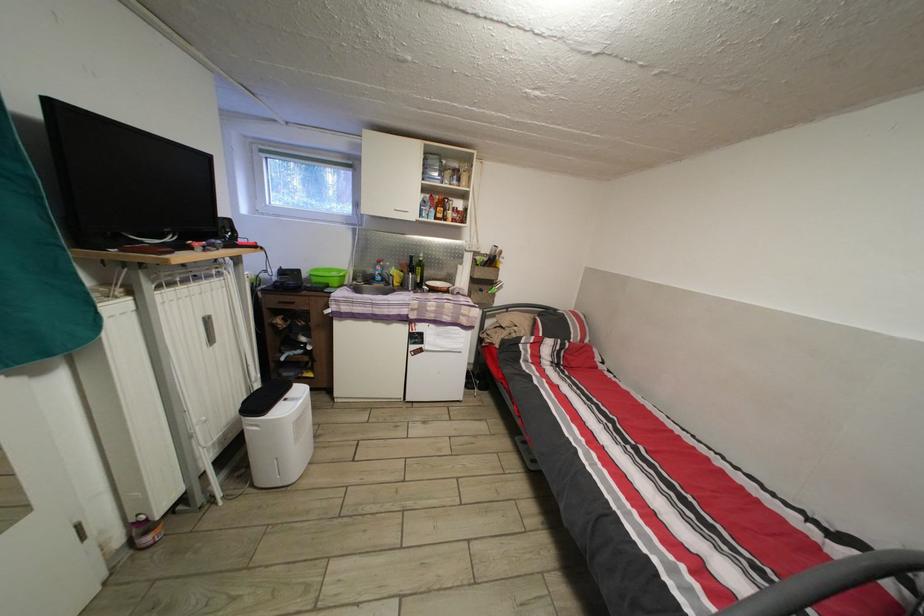
The width and height of the screenshot is (924, 616). Find the location of `white air purifier`. white air purifier is located at coordinates (199, 358).